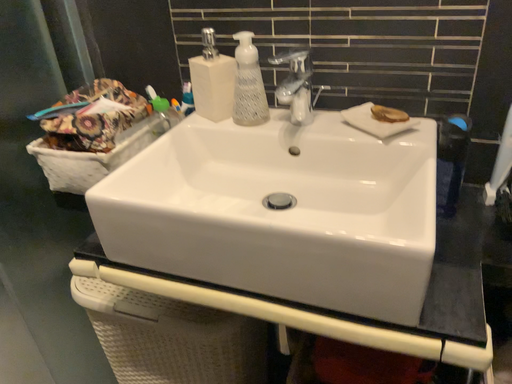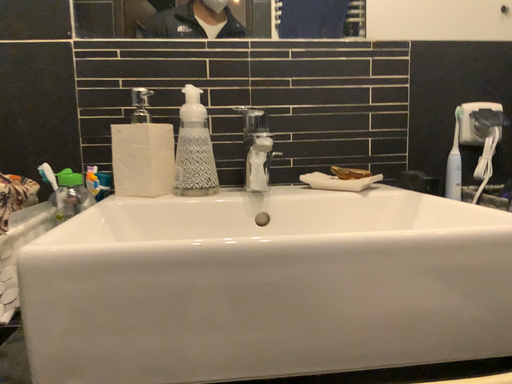
Question: Which way did the camera rotate in the video?

Choices:
 (A) rotated downward
 (B) rotated upward

Answer: (B)